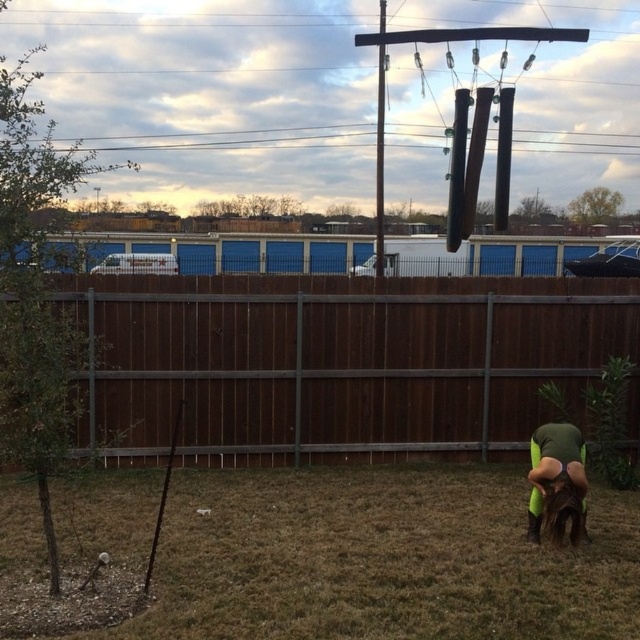
Between brown dry grass at lower center and brown furry dog at lower right, which one is positioned higher?

brown furry dog at lower right

Can you confirm if brown dry grass at lower center is shorter than brown furry dog at lower right?

Indeed, brown dry grass at lower center has a lesser height compared to brown furry dog at lower right.

Is point (424, 605) less distant than point (545, 520)?

That is True.

This screenshot has height=640, width=640. In order to click on brown dry grass at lower center in this screenshot , I will do `click(381, 560)`.

Who is more forward, [170,392] or [380,157]?

Point [170,392] is in front.

Which is above, brown wood fence at center or black wood pole at upper center?

Positioned higher is black wood pole at upper center.

Which is in front, point (150, 330) or point (380, 83)?

Point (150, 330)

Where is `brown wood fence at center`? Image resolution: width=640 pixels, height=640 pixels. brown wood fence at center is located at coordinates (339, 362).

The image size is (640, 640). What do you see at coordinates (563, 512) in the screenshot?
I see `brown furry dog at lower right` at bounding box center [563, 512].

Is point (560, 541) closer to camera compared to point (378, 72)?

Yes, point (560, 541) is in front of point (378, 72).

At what (x,y) coordinates should I click in order to perform the action: click on brown furry dog at lower right. Please return your answer as a coordinate pair (x, y). Looking at the image, I should click on (563, 512).